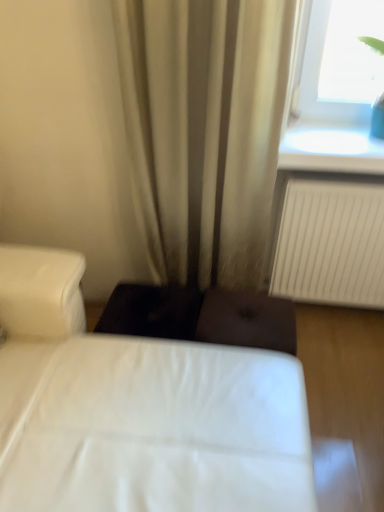
Question: In terms of width, does transparent glass at upper right look wider or thinner when compared to beige fabric curtain at center?

Choices:
 (A) wide
 (B) thin

Answer: (A)

Question: From the image's perspective, relative to beige fabric curtain at center, is transparent glass at upper right above or below?

Choices:
 (A) below
 (B) above

Answer: (B)

Question: Which is nearer to the transparent glass at upper right?

Choices:
 (A) beige fabric curtain at center
 (B) white fabric bed at center

Answer: (A)

Question: Which object is the closest to the white fabric bed at center?

Choices:
 (A) transparent glass at upper right
 (B) beige fabric curtain at center

Answer: (B)